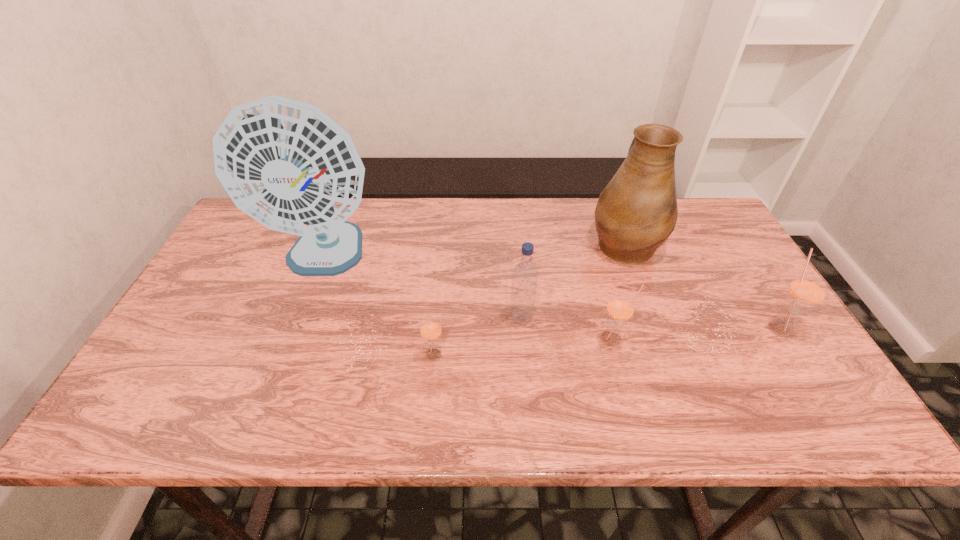
Locate an element on the screen. The width and height of the screenshot is (960, 540). object that is at the right edge is located at coordinates (806, 291).

This screenshot has width=960, height=540. What are the coordinates of `object present at the far left corner` in the screenshot? It's located at (287, 164).

In the image, there is a desktop. Identify the location of vacant space at the far edge. (590, 207).

Find the location of a particular element. The height and width of the screenshot is (540, 960). free region at the near edge of the desktop is located at coordinates (730, 364).

Identify the location of free location at the left edge. (209, 327).

The width and height of the screenshot is (960, 540). What are the coordinates of `free spot at the near left corner of the desktop` in the screenshot? It's located at (155, 365).

Identify the location of vacant space at the far right corner of the desktop. Image resolution: width=960 pixels, height=540 pixels. (705, 206).

The width and height of the screenshot is (960, 540). I want to click on unoccupied position between the second object from left to right and the second straw from right to left, so click(x=524, y=348).

Identify the location of empty space between the second tallest object and the water bottle. (573, 281).

Locate an element on the screen. Image resolution: width=960 pixels, height=540 pixels. vacant area between the second straw from left to right and the rightmost object is located at coordinates (695, 334).